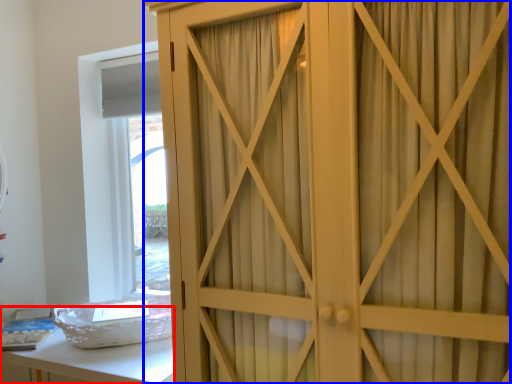
Question: Among these objects, which one is nearest to the camera, vanity (highlighted by a red box) or cupboard (highlighted by a blue box)?

Choices:
 (A) vanity
 (B) cupboard

Answer: (B)